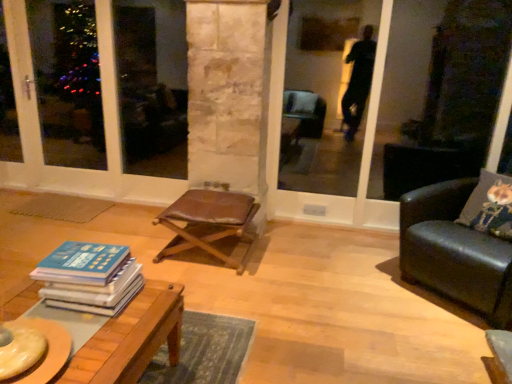
Locate an element on the screen. This screenshot has width=512, height=384. vacant space to the right of blue hardcover book at lower left is located at coordinates (143, 310).